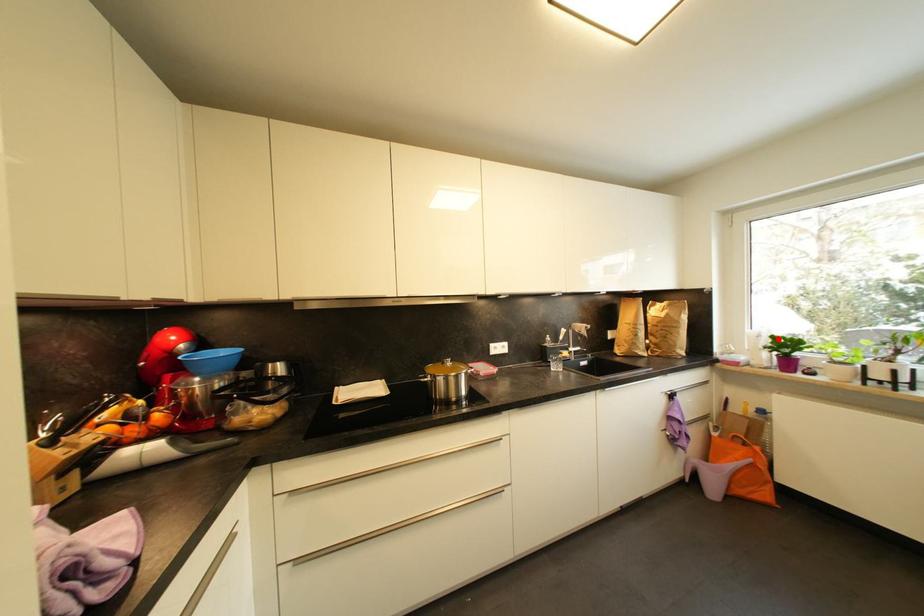
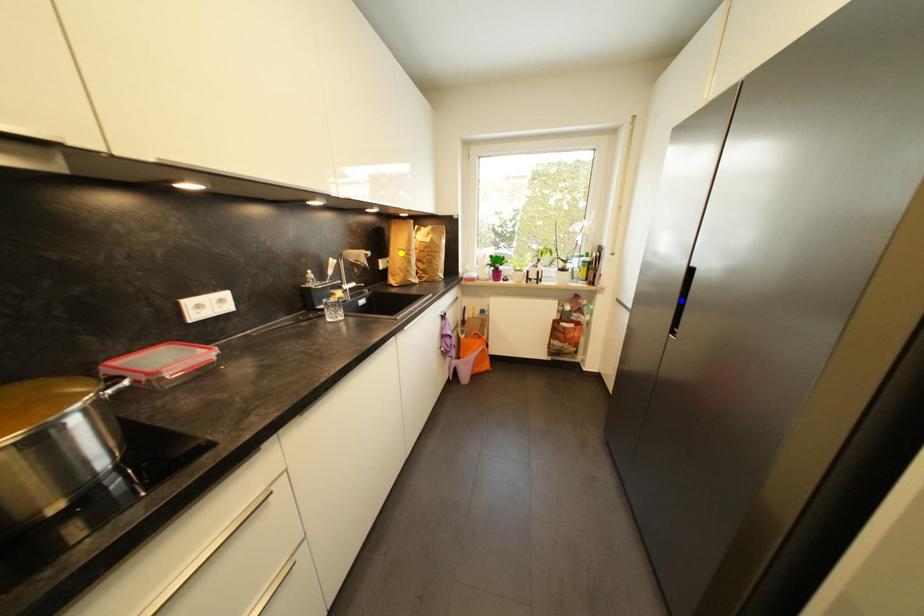
Question: I am providing you with two images of the same scene from different viewpoints. A red point is marked on the first image. You are given multiple points on the second image. Which mark in image 2 goes with the point in image 1?

Choices:
 (A) blue point
 (B) yellow point
 (C) green point

Answer: (C)